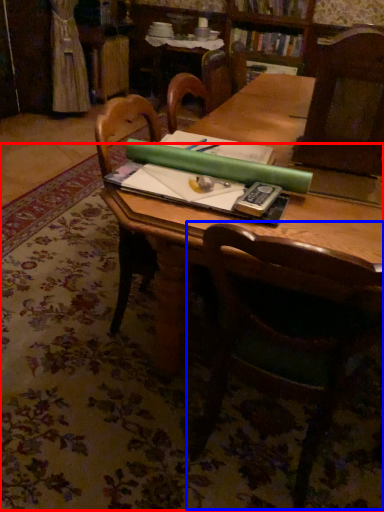
Question: Among these objects, which one is nearest to the camera, mat (highlighted by a red box) or chair (highlighted by a blue box)?

Choices:
 (A) mat
 (B) chair

Answer: (B)